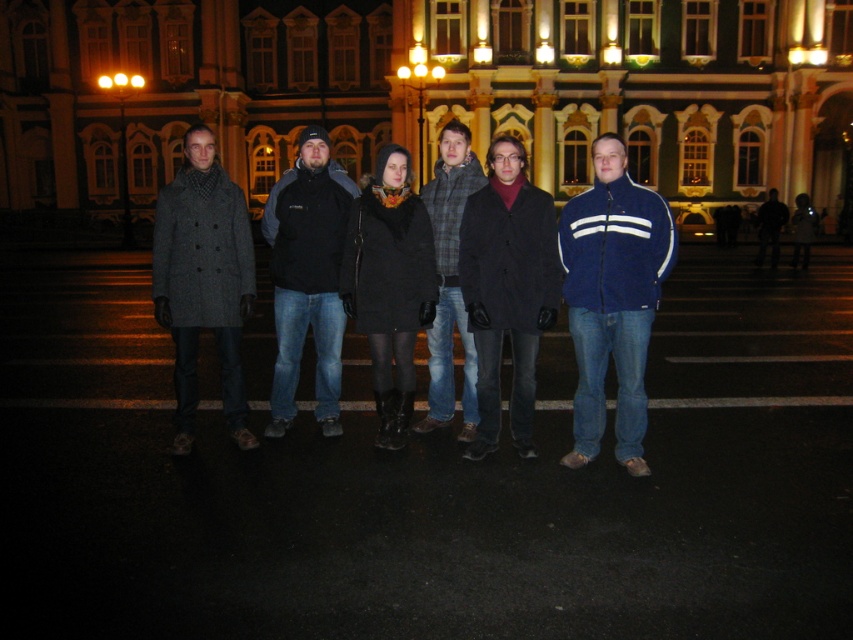
Question: Which object is positioned closest to the blue fleece jacket at center?

Choices:
 (A) dark gray wool coat at center
 (B) dark gray fleece jacket at center

Answer: (B)

Question: Is blue fleece jacket at center positioned behind dark gray wool coat at center?

Choices:
 (A) no
 (B) yes

Answer: (A)

Question: Which point is farther to the camera?

Choices:
 (A) matte black coat at center
 (B) dark gray wool coat at center

Answer: (A)

Question: Considering the relative positions of dark gray wool coat at center and plaid wool sweater at center in the image provided, where is dark gray wool coat at center located with respect to plaid wool sweater at center?

Choices:
 (A) below
 (B) above

Answer: (A)

Question: Observing the image, what is the correct spatial positioning of dark gray wool coat at center in reference to plaid wool sweater at center?

Choices:
 (A) right
 (B) left

Answer: (B)

Question: Which of the following is the farthest from the observer?

Choices:
 (A) dark gray fleece jacket at center
 (B) matte black coat at center
 (C) plaid wool sweater at center
 (D) blue fleece jacket at center

Answer: (A)